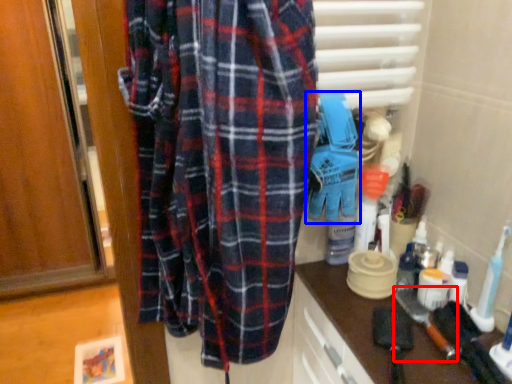
Question: Among these objects, which one is farthest to the camera, brush (highlighted by a red box) or toy (highlighted by a blue box)?

Choices:
 (A) brush
 (B) toy

Answer: (A)